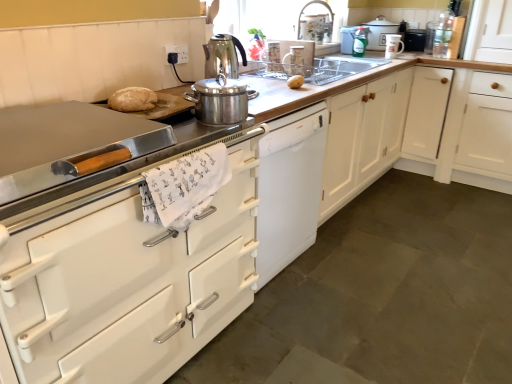
Locate an element on the screen. vacant area situated to the left side of clear glass pitcher at upper center, marked as the 3th kitchen appliance in a front-to-back arrangement is located at coordinates (265, 73).